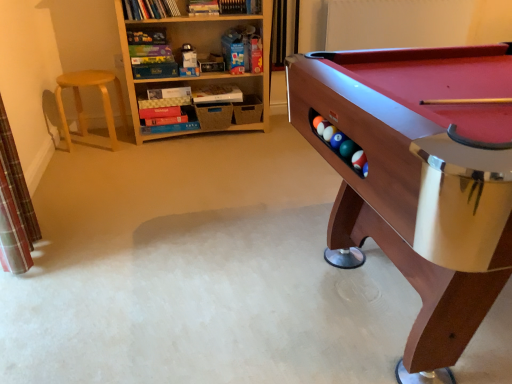
Question: Can you confirm if light brown wooden stool at left is wider than wooden pool table at right?

Choices:
 (A) yes
 (B) no

Answer: (B)

Question: From the image's perspective, is light brown wooden stool at left beneath wooden pool table at right?

Choices:
 (A) yes
 (B) no

Answer: (B)

Question: From a real-world perspective, is light brown wooden stool at left physically below wooden pool table at right?

Choices:
 (A) yes
 (B) no

Answer: (A)

Question: Is light brown wooden stool at left taller than wooden pool table at right?

Choices:
 (A) no
 (B) yes

Answer: (A)

Question: Is light brown wooden stool at left turned away from wooden pool table at right?

Choices:
 (A) yes
 (B) no

Answer: (B)

Question: Considering the relative positions of light brown wooden stool at left and wooden pool table at right in the image provided, is light brown wooden stool at left in front of wooden pool table at right?

Choices:
 (A) no
 (B) yes

Answer: (A)

Question: From the image's perspective, does wooden pool table at right appear higher than wooden bookshelf at upper left?

Choices:
 (A) yes
 (B) no

Answer: (B)

Question: Is wooden pool table at right oriented towards wooden bookshelf at upper left?

Choices:
 (A) no
 (B) yes

Answer: (A)

Question: Does wooden pool table at right touch wooden bookshelf at upper left?

Choices:
 (A) no
 (B) yes

Answer: (A)

Question: Does wooden pool table at right have a greater width compared to wooden bookshelf at upper left?

Choices:
 (A) yes
 (B) no

Answer: (A)

Question: Is wooden pool table at right taller than wooden bookshelf at upper left?

Choices:
 (A) no
 (B) yes

Answer: (A)

Question: Is wooden pool table at right positioned with its back to wooden bookshelf at upper left?

Choices:
 (A) no
 (B) yes

Answer: (B)

Question: Considering the relative sizes of wooden pool table at right and light brown wooden stool at left in the image provided, is wooden pool table at right shorter than light brown wooden stool at left?

Choices:
 (A) no
 (B) yes

Answer: (A)